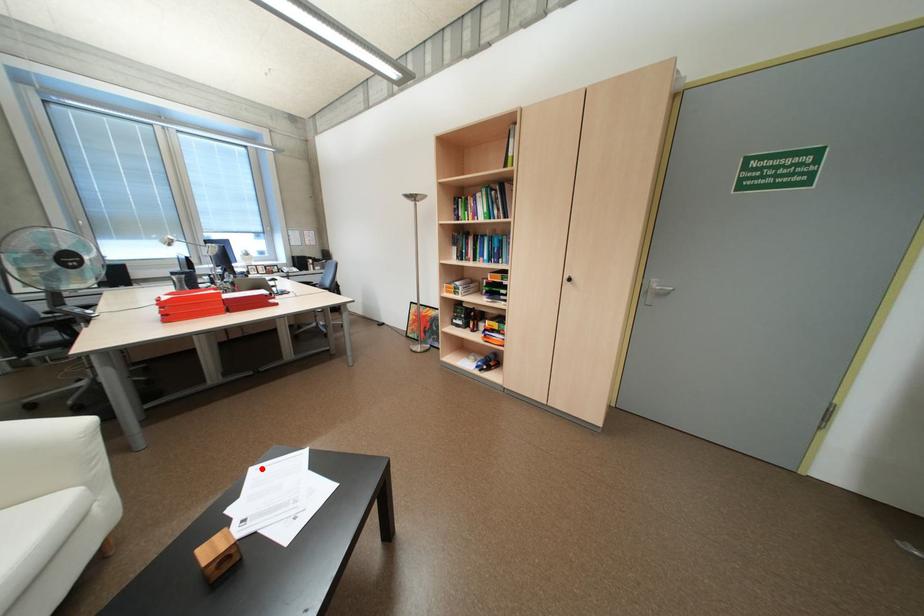
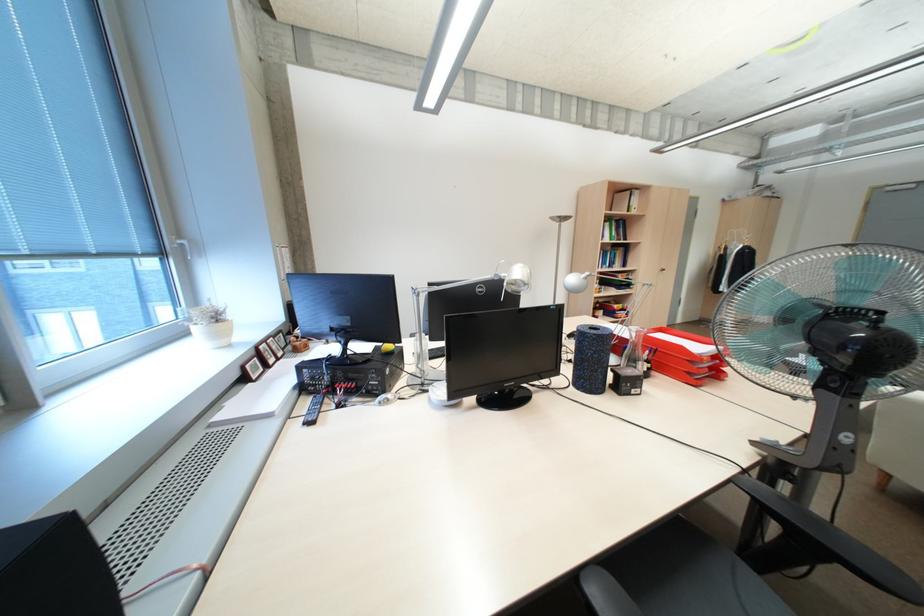
Question: I am providing you with two images of the same scene from different viewpoints. A red point is marked on the first image. Can you still see the location of the red point in image 2?

Choices:
 (A) Yes
 (B) No

Answer: (B)